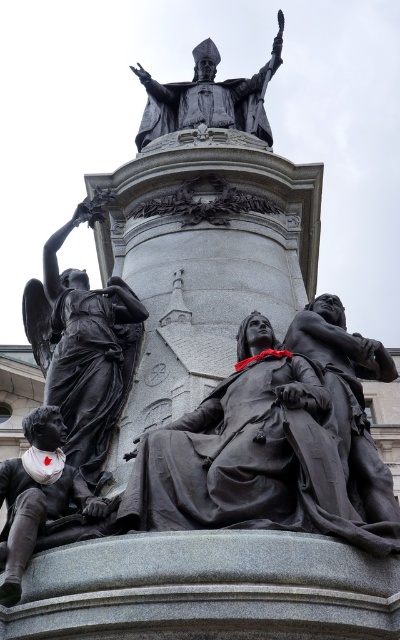
Does point (246, 433) come closer to viewer compared to point (57, 243)?

Yes, point (246, 433) is closer to viewer.

Is point (161, 465) less distant than point (65, 387)?

Yes, point (161, 465) is closer to viewer.

Find the location of a particular element. polished bronze statue at center is located at coordinates (244, 451).

Does polished bronze statue at center appear on the right side of bronze statue at upper center?

Correct, you'll find polished bronze statue at center to the right of bronze statue at upper center.

Does point (144, 468) come in front of point (164, 116)?

Yes, point (144, 468) is in front of point (164, 116).

This screenshot has height=640, width=400. I want to click on polished bronze statue at center, so click(x=244, y=451).

Is matte black statue at center bigger than bronze statue at lower left?

Yes, matte black statue at center is bigger than bronze statue at lower left.

Describe the element at coordinates (349, 397) in the screenshot. The width and height of the screenshot is (400, 640). I see `matte black statue at center` at that location.

Find the location of `matte black statue at center`. matte black statue at center is located at coordinates (349, 397).